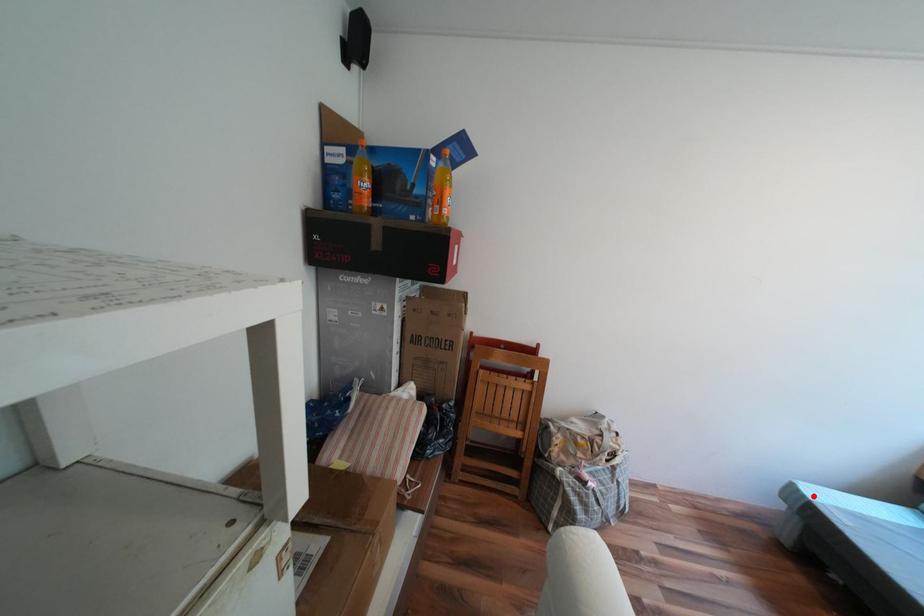
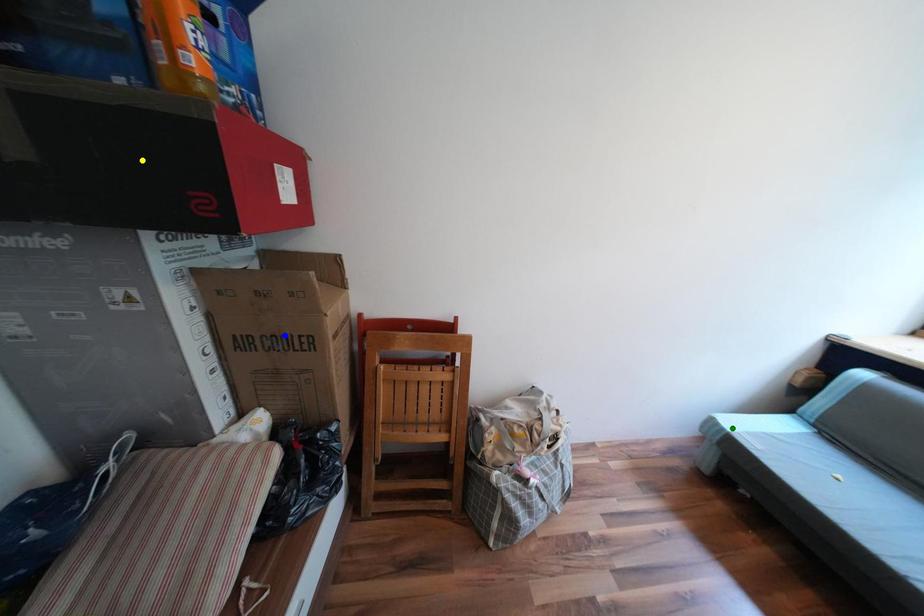
Question: I am providing you with two images of the same scene from different viewpoints. A red point is marked on the first image. You are given multiple points on the second image. Which point in image 2 represents the same 3d spot as the red point in image 1?

Choices:
 (A) green point
 (B) blue point
 (C) yellow point

Answer: (A)